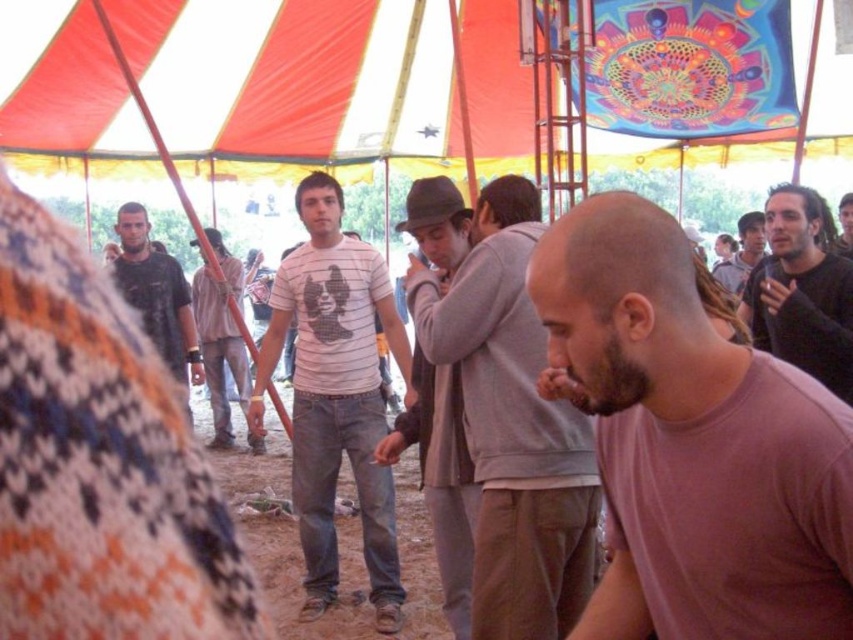
Is point (438, 403) positioned after point (799, 240)?

No, it is not.

Does gray woolen sweater at center have a smaller size compared to black matte shirt at right?

Actually, gray woolen sweater at center might be larger than black matte shirt at right.

Does point (450, 387) lie behind point (793, 337)?

Yes, it is.

This screenshot has height=640, width=853. Identify the location of gray woolen sweater at center. (440, 477).

Which is below, striped cotton shirt at center or dark brown hair at center?

striped cotton shirt at center is below.

Between point (196, 275) and point (845, 212), which one is positioned behind?

Positioned behind is point (196, 275).

You are a GUI agent. You are given a task and a screenshot of the screen. Output one action in this format:
    pyautogui.click(x=<x>, y=<y>)
    Task: Click on the striped cotton shirt at center
    This screenshot has width=853, height=640.
    Given the screenshot: What is the action you would take?
    pyautogui.click(x=219, y=337)

In the scene shown: Which of these two, striped cotton shirt at center or dark gray sweater at center, stands taller?

striped cotton shirt at center

Consider the image. Between striped cotton shirt at center and dark gray sweater at center, which one is positioned higher?

dark gray sweater at center is above.

Is point (241, 285) positioned before point (749, 220)?

No, it is behind (749, 220).

Identify the location of striped cotton shirt at center. (219, 337).